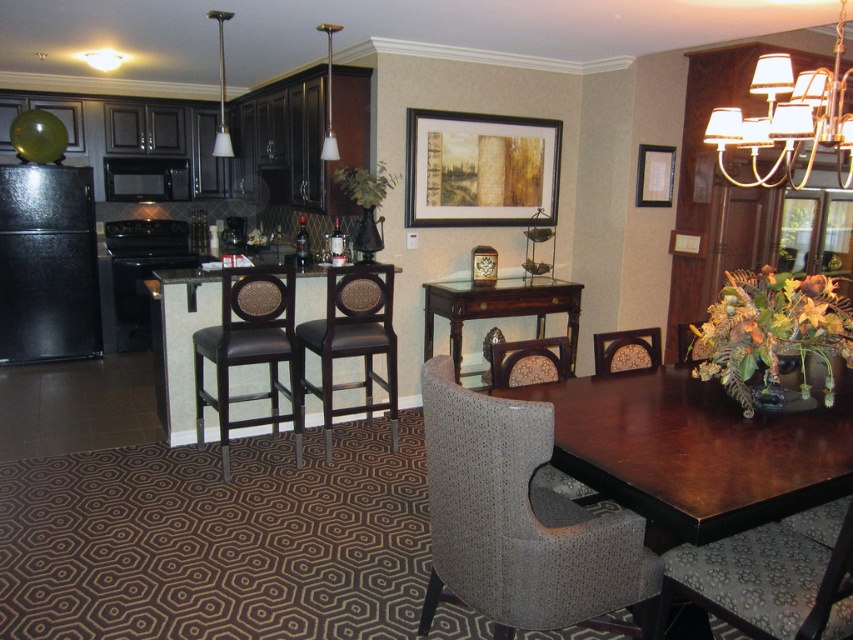
Question: Is black matte refrigerator at left to the left of black matte oven at left from the viewer's perspective?

Choices:
 (A) yes
 (B) no

Answer: (A)

Question: Is brown leather barstools at center to the right of mahogany wood table at center from the viewer's perspective?

Choices:
 (A) yes
 (B) no

Answer: (B)

Question: Does patterned fabric swivel chair at lower right appear on the right side of mahogany wood table at center?

Choices:
 (A) no
 (B) yes

Answer: (B)

Question: Which of the following is the farthest from the observer?

Choices:
 (A) (x=793, y=436)
 (B) (x=189, y=256)

Answer: (B)

Question: Which object is positioned closest to the mahogany wood table at center?

Choices:
 (A) brown leather chair at center
 (B) brown fabric armchair at center
 (C) white fabric chandelier at upper right

Answer: (A)

Question: Among these objects, which one is nearest to the camera?

Choices:
 (A) brown leather barstools at center
 (B) brown leather chair at center

Answer: (B)